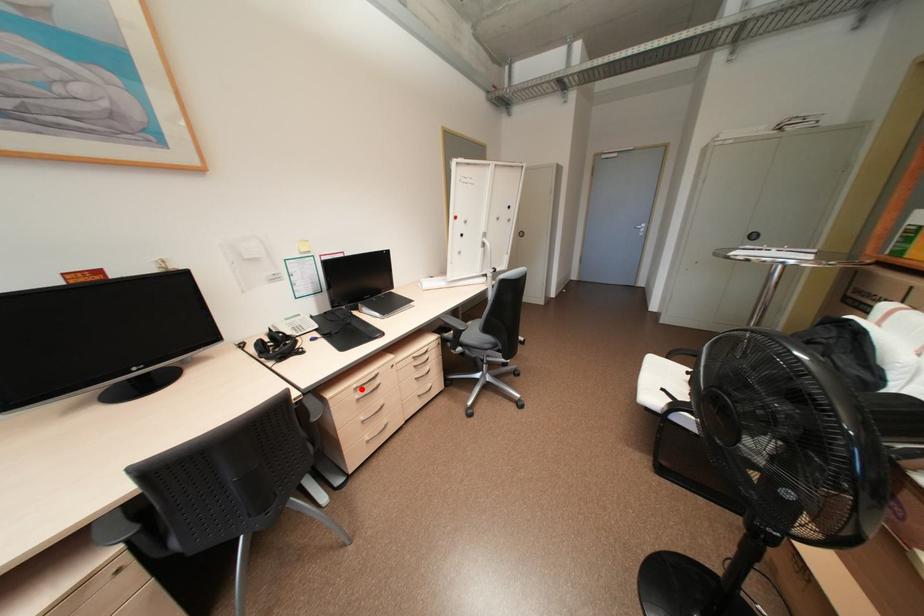
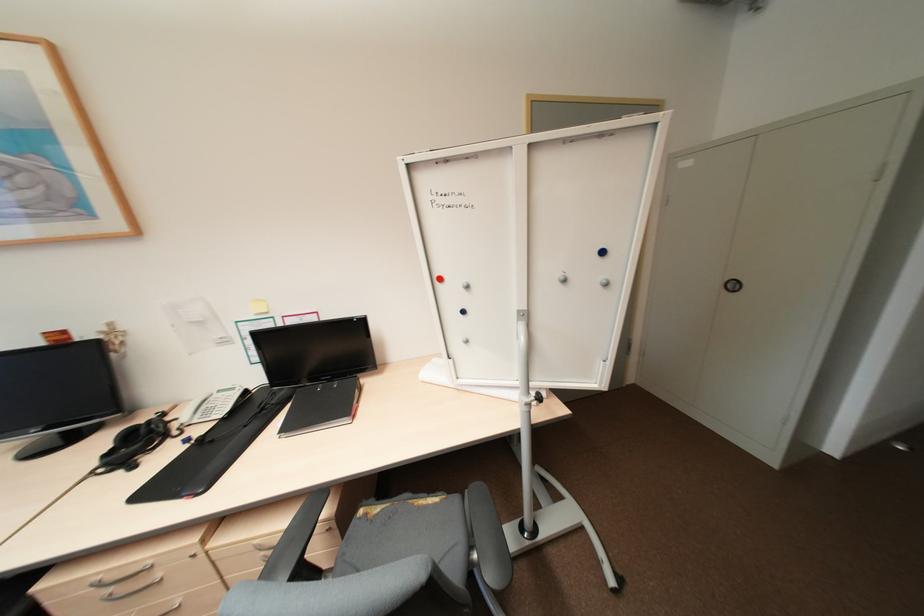
Question: I am providing you with two images of the same scene from different viewpoints. In image1, a red point is highlighted. Considering the same 3D point in image2, which of the following is correct?

Choices:
 (A) It is closer
 (B) It is farther

Answer: (A)